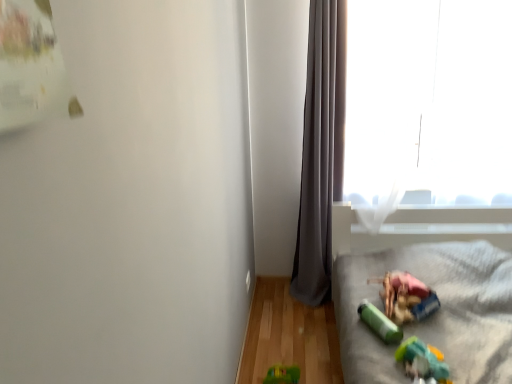
Question: Considering the relative positions of plush gray blanket at lower right and green rubber toy at lower right, which appears as the second toy when viewed from the front, in the image provided, is plush gray blanket at lower right to the left of green rubber toy at lower right, which appears as the second toy when viewed from the front, from the viewer's perspective?

Choices:
 (A) no
 (B) yes

Answer: (A)

Question: Considering the relative positions of plush gray blanket at lower right and green rubber toy at lower right, which appears as the second toy when viewed from the front, in the image provided, is plush gray blanket at lower right to the right of green rubber toy at lower right, which appears as the second toy when viewed from the front, from the viewer's perspective?

Choices:
 (A) no
 (B) yes

Answer: (B)

Question: From a real-world perspective, is plush gray blanket at lower right beneath green rubber toy at lower right, acting as the first toy starting from the back?

Choices:
 (A) yes
 (B) no

Answer: (A)

Question: Does plush gray blanket at lower right contain green rubber toy at lower right, acting as the first toy starting from the back?

Choices:
 (A) yes
 (B) no

Answer: (A)

Question: Is the surface of plush gray blanket at lower right in direct contact with green rubber toy at lower right, acting as the first toy starting from the back?

Choices:
 (A) yes
 (B) no

Answer: (B)

Question: From the image's perspective, is plush gray blanket at lower right under green rubber toy at lower right, acting as the first toy starting from the back?

Choices:
 (A) yes
 (B) no

Answer: (A)

Question: Is plastic green toy at lower right, arranged as the 2th toy when viewed from the back, closer to camera compared to green plastic toy at lower right?

Choices:
 (A) yes
 (B) no

Answer: (A)

Question: From a real-world perspective, is plastic green toy at lower right, the first toy when ordered from front to back, located higher than green plastic toy at lower right?

Choices:
 (A) no
 (B) yes

Answer: (A)

Question: Is plastic green toy at lower right, the first toy when ordered from front to back, oriented away from green plastic toy at lower right?

Choices:
 (A) no
 (B) yes

Answer: (A)

Question: Is there a large distance between plastic green toy at lower right, arranged as the 2th toy when viewed from the back, and green plastic toy at lower right?

Choices:
 (A) yes
 (B) no

Answer: (B)

Question: Does plastic green toy at lower right, arranged as the 2th toy when viewed from the back, touch green plastic toy at lower right?

Choices:
 (A) no
 (B) yes

Answer: (A)

Question: Could you tell me if plastic green toy at lower right, arranged as the 2th toy when viewed from the back, is turned towards green plastic toy at lower right?

Choices:
 (A) no
 (B) yes

Answer: (A)

Question: Is plush gray blanket at lower right taller than transparent glass window at upper right?

Choices:
 (A) no
 (B) yes

Answer: (A)